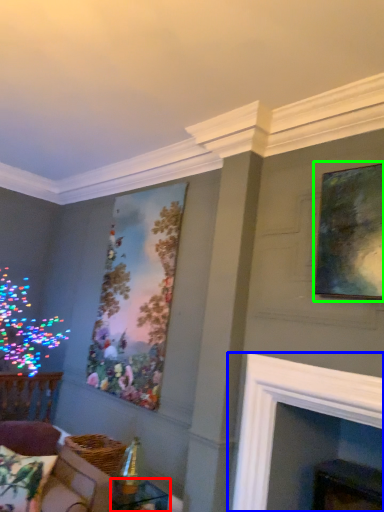
Question: Considering the real-world distances, which object is closest to table (highlighted by a red box)? fireplace (highlighted by a blue box) or picture frame (highlighted by a green box).

Choices:
 (A) fireplace
 (B) picture frame

Answer: (A)